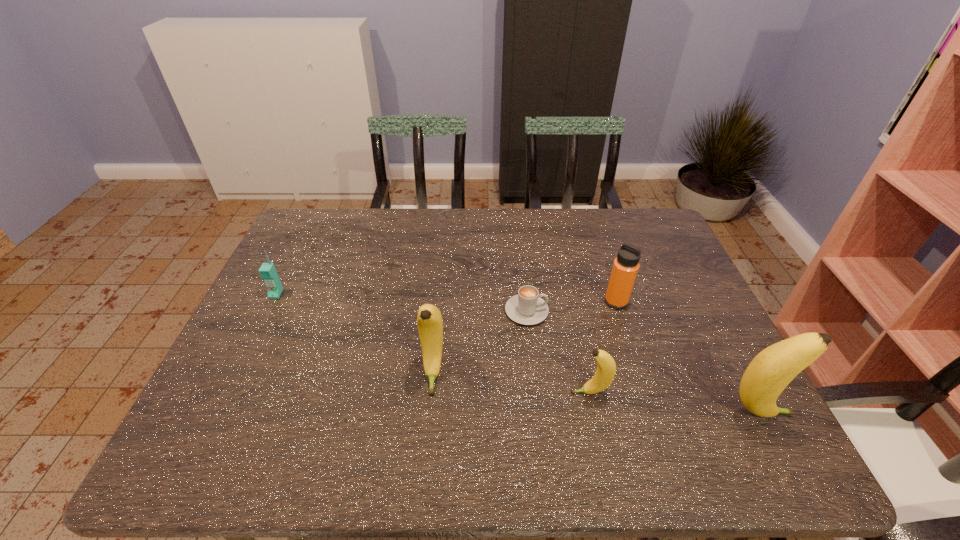
In the image, there is a desktop. Where is `vacant space at the far edge`? Image resolution: width=960 pixels, height=540 pixels. vacant space at the far edge is located at coordinates (482, 222).

Where is `vacant point at the near edge`? vacant point at the near edge is located at coordinates (478, 402).

The height and width of the screenshot is (540, 960). Identify the location of vacant region at the left edge of the desktop. (243, 371).

Where is `vacant area at the right edge`? The height and width of the screenshot is (540, 960). vacant area at the right edge is located at coordinates (675, 315).

You are a GUI agent. You are given a task and a screenshot of the screen. Output one action in this format:
    pyautogui.click(x=<x>, y=<y>)
    Task: Click on the free space at the far left corner
    
    Given the screenshot: What is the action you would take?
    pyautogui.click(x=324, y=249)

Where is `vacant space at the far right corner`? The image size is (960, 540). vacant space at the far right corner is located at coordinates (640, 248).

Find the location of a particular element. The image size is (960, 540). unoccupied position between the rightmost object and the shortest banana is located at coordinates (674, 403).

What are the coordinates of `vacant region between the rightmost object and the leftmost object` in the screenshot? It's located at (517, 354).

Where is `blank region between the second banana from left to right and the nearest banana`? The height and width of the screenshot is (540, 960). blank region between the second banana from left to right and the nearest banana is located at coordinates (674, 403).

Find the location of `empty space between the fifth object from right to left and the fifth object from left to right`. empty space between the fifth object from right to left and the fifth object from left to right is located at coordinates (524, 338).